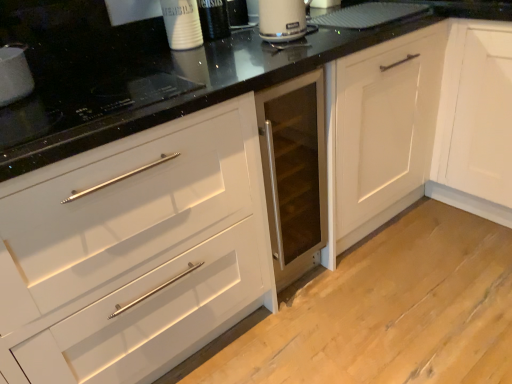
Question: From the image's perspective, is white matte cabinet at center located beneath black glass cooktop at upper left, marked as the second appliance in a left-to-right arrangement?

Choices:
 (A) no
 (B) yes

Answer: (A)

Question: Does white matte cabinet at center lie in front of black glass cooktop at upper left, marked as the second appliance in a left-to-right arrangement?

Choices:
 (A) yes
 (B) no

Answer: (B)

Question: Is the position of white matte cabinet at center more distant than that of black glass cooktop at upper left, marked as the second appliance in a left-to-right arrangement?

Choices:
 (A) yes
 (B) no

Answer: (A)

Question: Does white matte cabinet at center appear on the right side of black glass cooktop at upper left, marked as the second appliance in a left-to-right arrangement?

Choices:
 (A) yes
 (B) no

Answer: (A)

Question: Considering the relative positions of white matte cabinet at center and black glass cooktop at upper left, which appears as the first appliance when viewed from the right, in the image provided, is white matte cabinet at center to the left of black glass cooktop at upper left, which appears as the first appliance when viewed from the right, from the viewer's perspective?

Choices:
 (A) yes
 (B) no

Answer: (B)

Question: From a real-world perspective, relative to matte black induction cooktop at upper left, marked as the second appliance in a right-to-left arrangement, is white matte cabinet at center vertically above or below?

Choices:
 (A) above
 (B) below

Answer: (B)

Question: In the image, is white matte cabinet at center positioned in front of or behind matte black induction cooktop at upper left, placed as the first appliance when sorted from left to right?

Choices:
 (A) front
 (B) behind

Answer: (B)

Question: Would you say white matte cabinet at center is inside or outside matte black induction cooktop at upper left, placed as the first appliance when sorted from left to right?

Choices:
 (A) inside
 (B) outside

Answer: (B)

Question: Considering the relative positions of white matte cabinet at center and matte black induction cooktop at upper left, marked as the second appliance in a right-to-left arrangement, in the image provided, is white matte cabinet at center to the left or to the right of matte black induction cooktop at upper left, marked as the second appliance in a right-to-left arrangement,?

Choices:
 (A) right
 (B) left

Answer: (A)

Question: Is matte black induction cooktop at upper left, marked as the second appliance in a right-to-left arrangement, inside or outside of white matte cabinet at center?

Choices:
 (A) inside
 (B) outside

Answer: (B)

Question: Considering the positions of point (27, 94) and point (353, 216), is point (27, 94) closer or farther from the camera than point (353, 216)?

Choices:
 (A) closer
 (B) farther

Answer: (A)

Question: Relative to white matte cabinet at center, is matte black induction cooktop at upper left, marked as the second appliance in a right-to-left arrangement, in front or behind?

Choices:
 (A) behind
 (B) front

Answer: (B)

Question: In the image, is matte black induction cooktop at upper left, placed as the first appliance when sorted from left to right, on the left side or the right side of white matte cabinet at center?

Choices:
 (A) right
 (B) left

Answer: (B)

Question: Based on their positions, is black glass cooktop at upper left, which appears as the first appliance when viewed from the right, located to the left or right of matte black induction cooktop at upper left, marked as the second appliance in a right-to-left arrangement?

Choices:
 (A) left
 (B) right

Answer: (B)

Question: In terms of width, does black glass cooktop at upper left, which appears as the first appliance when viewed from the right, look wider or thinner when compared to matte black induction cooktop at upper left, marked as the second appliance in a right-to-left arrangement?

Choices:
 (A) thin
 (B) wide

Answer: (B)